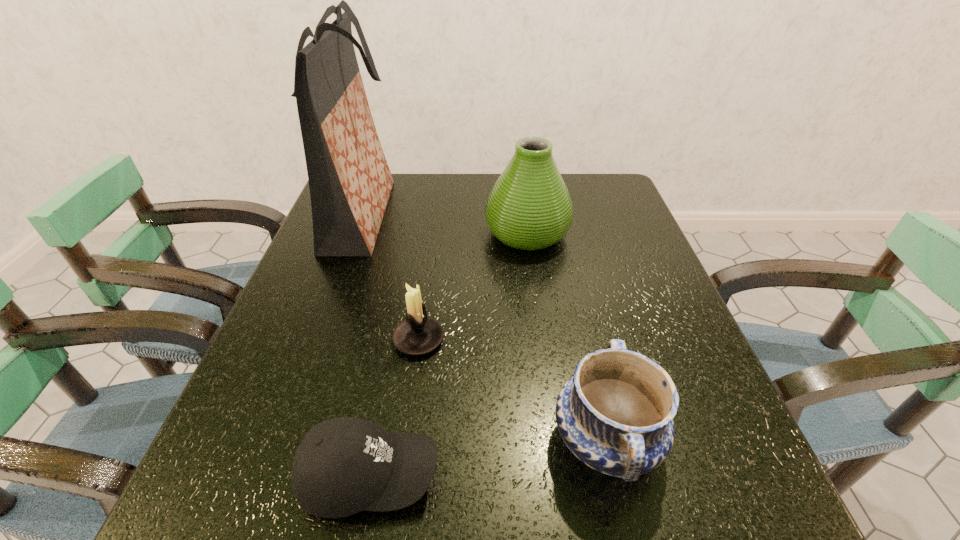
Identify the location of free space between the vase and the pottery. The height and width of the screenshot is (540, 960). (566, 336).

Identify the location of vacant area between the baseball cap and the vase. (448, 354).

Locate an element on the screen. Image resolution: width=960 pixels, height=540 pixels. free space between the shopping bag and the pottery is located at coordinates (484, 327).

Locate an element on the screen. The height and width of the screenshot is (540, 960). free space between the candle holder and the pottery is located at coordinates (513, 389).

Where is `object that stands as the second closest to the baseball cap`? This screenshot has width=960, height=540. object that stands as the second closest to the baseball cap is located at coordinates (615, 414).

Identify the location of the third closest object relative to the pottery. Image resolution: width=960 pixels, height=540 pixels. (529, 207).

At what (x,y) coordinates should I click in order to perform the action: click on vacant space that satisfies the following two spatial constraints: 1. on the front-facing side of the shopping bag; 2. on the right side of the vase. Please return your answer as a coordinate pair (x, y). Looking at the image, I should click on (355, 233).

The height and width of the screenshot is (540, 960). Find the location of `vacant space that satisfies the following two spatial constraints: 1. on the front-facing side of the shopping bag; 2. on the back side of the pottery`. vacant space that satisfies the following two spatial constraints: 1. on the front-facing side of the shopping bag; 2. on the back side of the pottery is located at coordinates (279, 440).

You are a GUI agent. You are given a task and a screenshot of the screen. Output one action in this format:
    pyautogui.click(x=<x>, y=<y>)
    Task: Click on the blank space that satisfies the following two spatial constraints: 1. on the front-facing side of the shopping bag; 2. on the right side of the pottery
    
    Given the screenshot: What is the action you would take?
    pyautogui.click(x=279, y=440)

I want to click on vacant space that satisfies the following two spatial constraints: 1. on the front side of the third nearest object; 2. on the front-facing side of the baseball cap, so [400, 476].